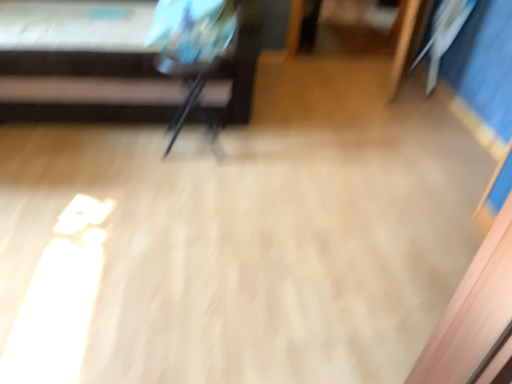
Question: Is metallic black armchair at center outside metallic silver tripod at upper left?

Choices:
 (A) yes
 (B) no

Answer: (A)

Question: From a real-world perspective, is metallic black armchair at center under metallic silver tripod at upper left?

Choices:
 (A) no
 (B) yes

Answer: (B)

Question: From a real-world perspective, is metallic black armchair at center located higher than metallic silver tripod at upper left?

Choices:
 (A) no
 (B) yes

Answer: (A)

Question: From the image's perspective, is metallic black armchair at center on top of metallic silver tripod at upper left?

Choices:
 (A) no
 (B) yes

Answer: (A)

Question: Considering the relative sizes of metallic black armchair at center and metallic silver tripod at upper left in the image provided, is metallic black armchair at center taller than metallic silver tripod at upper left?

Choices:
 (A) yes
 (B) no

Answer: (B)

Question: Is the position of metallic black armchair at center more distant than that of metallic silver tripod at upper left?

Choices:
 (A) no
 (B) yes

Answer: (B)

Question: From a real-world perspective, is metallic silver tripod at upper left under metallic black armchair at center?

Choices:
 (A) no
 (B) yes

Answer: (A)

Question: Is metallic black armchair at center surrounded by metallic silver tripod at upper left?

Choices:
 (A) no
 (B) yes

Answer: (A)

Question: Does metallic silver tripod at upper left appear on the right side of metallic black armchair at center?

Choices:
 (A) no
 (B) yes

Answer: (A)

Question: Does metallic silver tripod at upper left come in front of metallic black armchair at center?

Choices:
 (A) yes
 (B) no

Answer: (A)

Question: Is metallic silver tripod at upper left with metallic black armchair at center?

Choices:
 (A) no
 (B) yes

Answer: (A)

Question: Are metallic silver tripod at upper left and metallic black armchair at center located far from each other?

Choices:
 (A) yes
 (B) no

Answer: (B)

Question: From a real-world perspective, is metallic black armchair at center positioned above or below metallic silver tripod at upper left?

Choices:
 (A) above
 (B) below

Answer: (B)